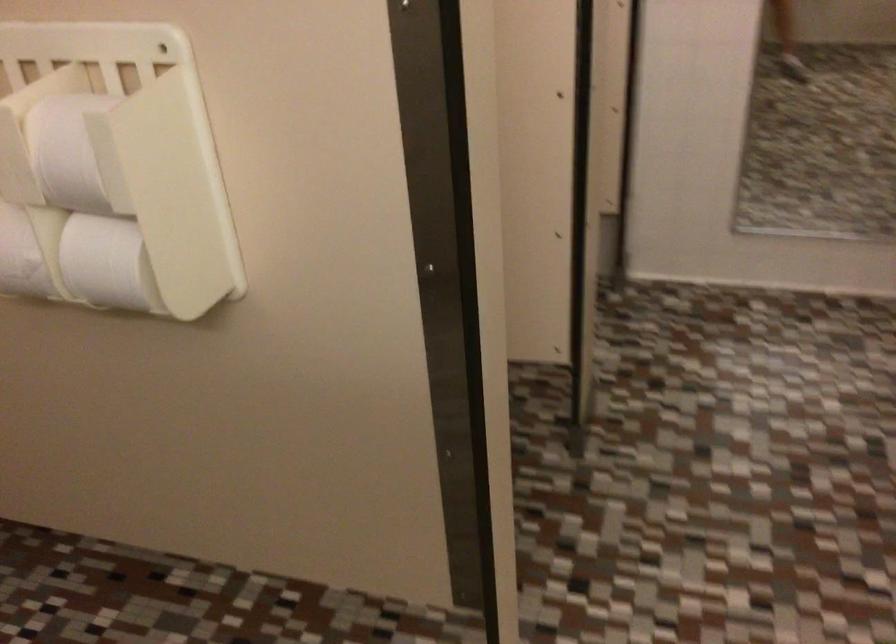
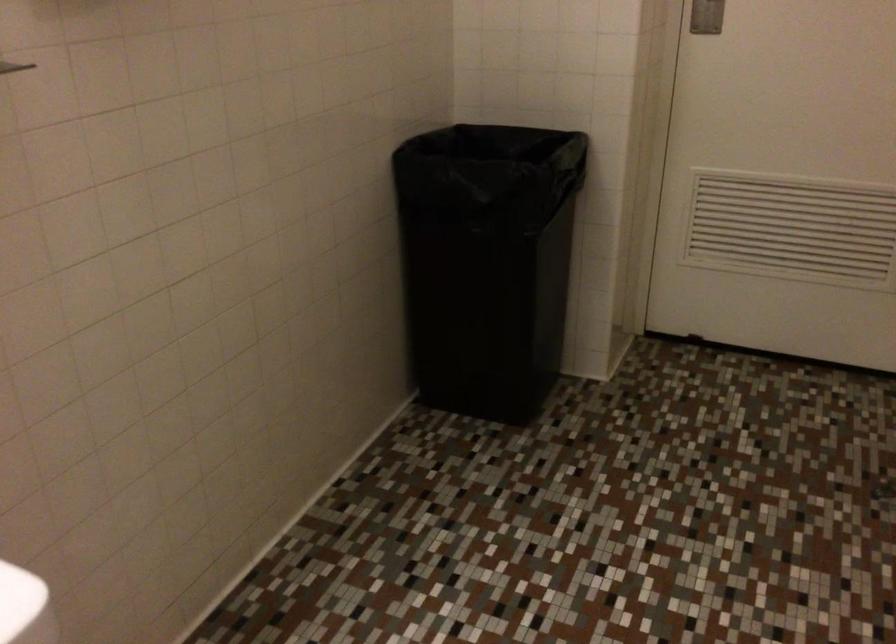
The first image is from the beginning of the video and the second image is from the end. How did the camera likely rotate when shooting the video?

The rotation direction of the camera is left-down.